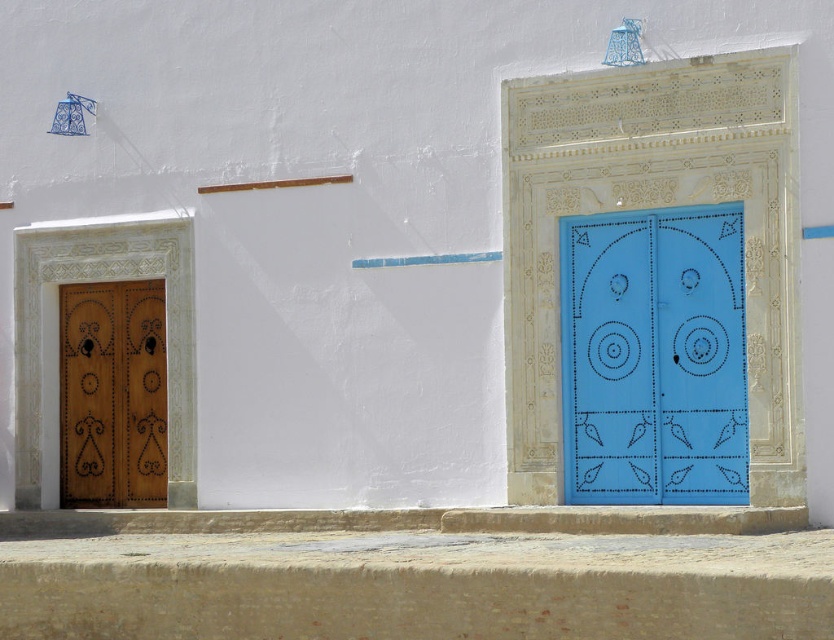
How distant is blue painted wood door at right from wooden door at left?

blue painted wood door at right and wooden door at left are 5.04 meters apart from each other.

Between blue painted wood door at right and wooden door at left, which one has less height?

Standing shorter between the two is wooden door at left.

Is point (666, 419) behind point (149, 308)?

No, (666, 419) is in front of (149, 308).

Image resolution: width=834 pixels, height=640 pixels. I want to click on blue painted wood door at right, so click(652, 356).